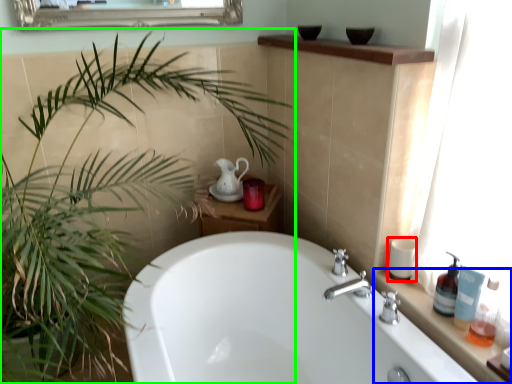
Question: Which is farther away from toiletry (highlighted by a red box)? counter top (highlighted by a blue box) or houseplant (highlighted by a green box)?

Choices:
 (A) counter top
 (B) houseplant

Answer: (B)